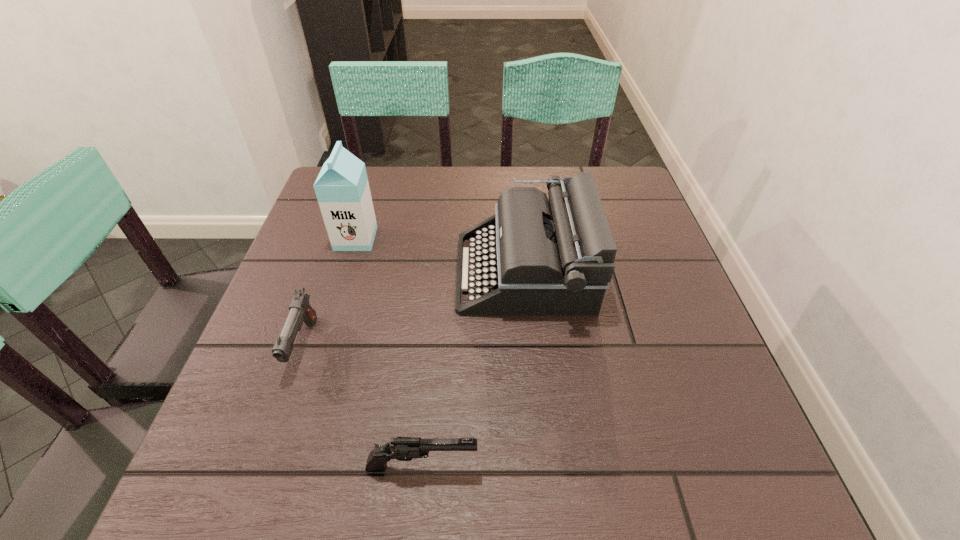
Find the location of `free space located at the end of the barrel of the nearest object`. free space located at the end of the barrel of the nearest object is located at coordinates (657, 467).

Where is `object that is positioned at the near edge`? object that is positioned at the near edge is located at coordinates (401, 448).

The height and width of the screenshot is (540, 960). I want to click on milk carton that is at the left edge, so click(x=342, y=189).

Locate an element on the screen. gun that is at the left edge is located at coordinates (300, 310).

Find the location of a particular element. blank area at the far edge is located at coordinates (438, 199).

At what (x,y) coordinates should I click in order to perform the action: click on vacant position at the near edge of the desktop. Please return your answer as a coordinate pair (x, y). Looking at the image, I should click on (453, 485).

The width and height of the screenshot is (960, 540). In the image, there is a desktop. Identify the location of vacant area at the left edge. (310, 275).

In the image, there is a desktop. Where is `vacant space at the right edge`? This screenshot has height=540, width=960. vacant space at the right edge is located at coordinates pos(667,387).

Locate an element on the screen. Image resolution: width=960 pixels, height=540 pixels. vacant space at the near left corner of the desktop is located at coordinates (253, 448).

This screenshot has width=960, height=540. I want to click on vacant space at the far right corner of the desktop, so click(614, 215).